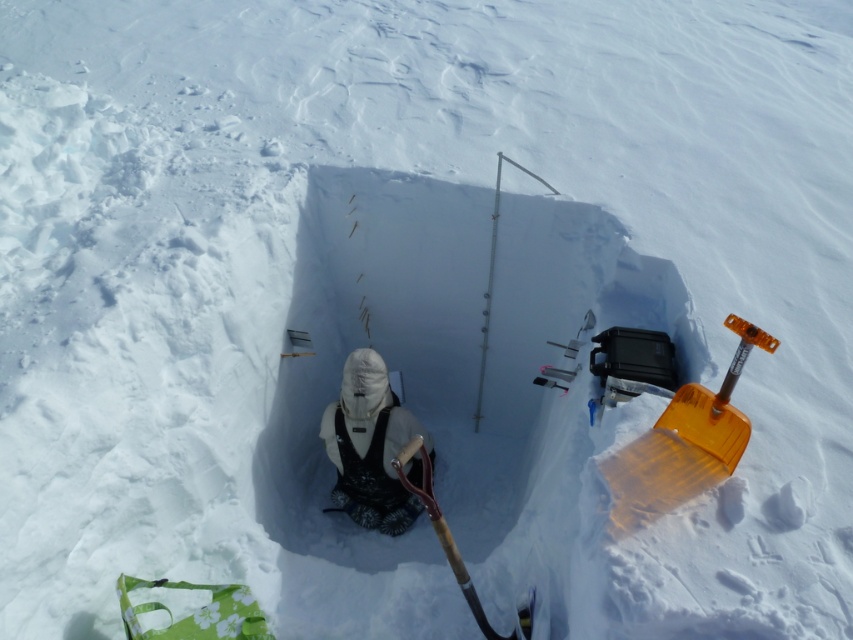
Question: Which point is farther to the camera?

Choices:
 (A) (521, 628)
 (B) (703, 422)

Answer: (A)

Question: Among these objects, which one is farthest from the camera?

Choices:
 (A) translucent orange shovel at right
 (B) wooden shovel at center

Answer: (B)

Question: Which point is farther to the camera?

Choices:
 (A) white fleece jacket at center
 (B) translucent orange shovel at right

Answer: (A)

Question: Does translucent orange shovel at right have a larger size compared to white fleece jacket at center?

Choices:
 (A) no
 (B) yes

Answer: (A)

Question: Is translucent orange shovel at right above wooden shovel at center?

Choices:
 (A) yes
 (B) no

Answer: (A)

Question: Does translucent orange shovel at right appear on the right side of wooden shovel at center?

Choices:
 (A) no
 (B) yes

Answer: (B)